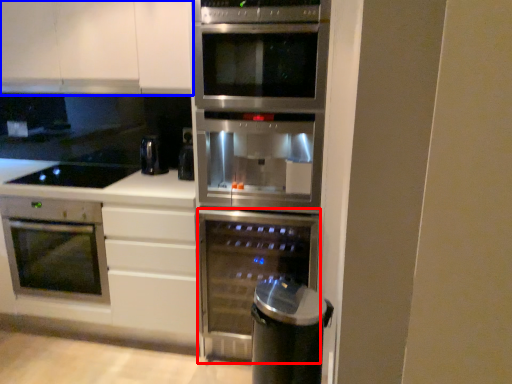
Question: Among these objects, which one is farthest to the camera, oven (highlighted by a red box) or cabinetry (highlighted by a blue box)?

Choices:
 (A) oven
 (B) cabinetry

Answer: (B)